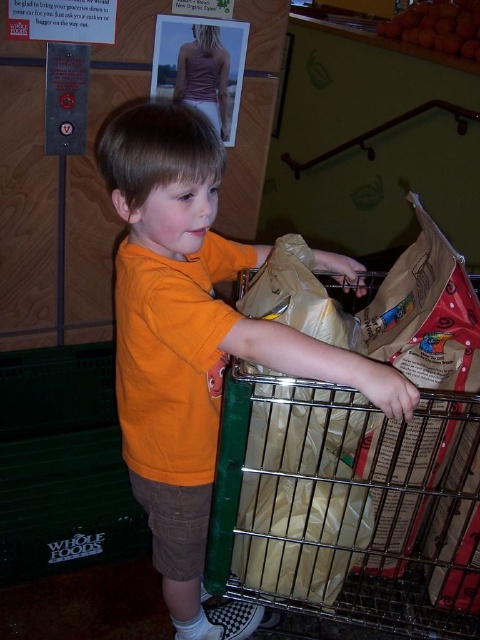
You are a store employee trying to locate a customer who is wearing an orange cotton shirt at center and pushing a metallic silver shopping cart at center. Based on the scene, where would you look first?

The orange cotton shirt at center is above the metallic silver shopping cart at center, so you should look at the area above the shopping cart to find the customer wearing the orange cotton shirt at center.

You are a customer in the store and want to take a photo of the orange cotton shirt at center with your camera. Can you do so without moving either the shirt or the camera?

The orange cotton shirt at center and camera are 30.96 inches apart from each other, so yes, you can take a photo without moving either the shirt or the camera since the distance is sufficient for a clear shot.

You are a store employee who needs to ensure all items are properly sized for their designated storage areas. The orange cotton shirt at center and the metallic silver shopping cart at center are both in the same area. Which item should you move first to accommodate their size requirements?

The orange cotton shirt at center is larger in size than the metallic silver shopping cart at center, so you should move the orange cotton shirt at center first to accommodate their size requirements.